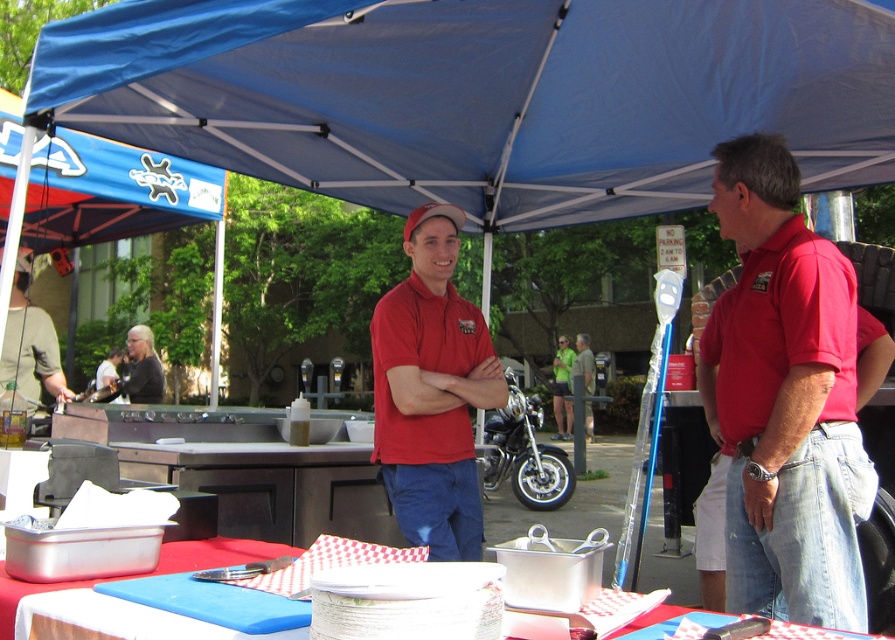
Question: Which of the following is the closest to the observer?

Choices:
 (A) green matte shirt at left
 (B) blue plastic cutting board at lower left

Answer: (B)

Question: Which object is farther from the camera taking this photo?

Choices:
 (A) matte black shirt at center
 (B) shiny black motorcycle at center

Answer: (B)

Question: Can you confirm if matte black shirt at center is smaller than matte red shirt at center?

Choices:
 (A) yes
 (B) no

Answer: (A)

Question: Can you confirm if green matte shirt at left is positioned above matte red shirt at center?

Choices:
 (A) no
 (B) yes

Answer: (B)

Question: Can you confirm if red cotton polo shirt at center is positioned to the right of matte black shirt at center?

Choices:
 (A) yes
 (B) no

Answer: (A)

Question: Which is nearer to the blue fabric canopy at upper center?

Choices:
 (A) matte black shirt at center
 (B) matte red shirt at center

Answer: (A)